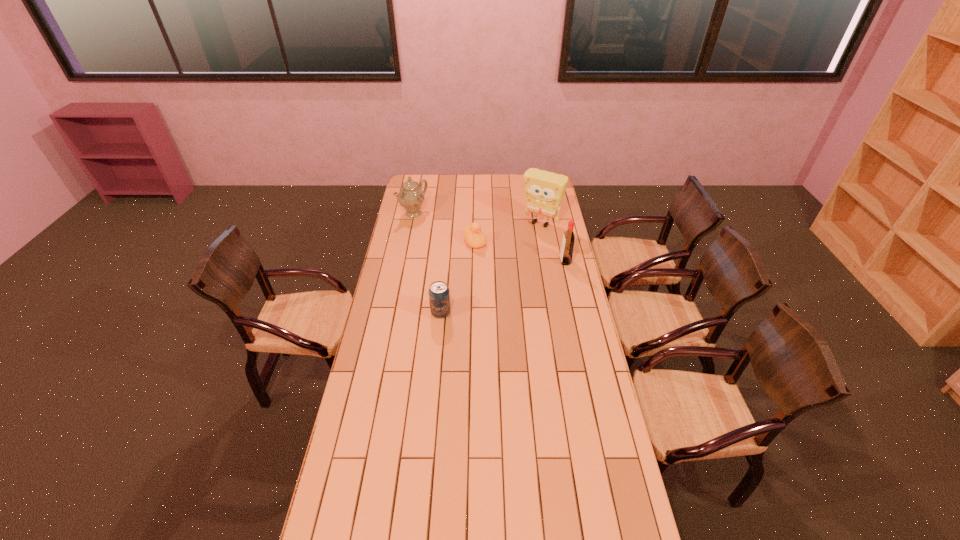
Find the location of a particular element. Image resolution: width=960 pixels, height=540 pixels. vacant spot on the desktop that is between the pop soda and the fourth farthest object and is positioned on the face of the duck is located at coordinates point(514,282).

Where is `vacant spot on the desktop that is between the fourth object from right to left and the second nearest object and is positioned on the face of the sponge`? This screenshot has width=960, height=540. vacant spot on the desktop that is between the fourth object from right to left and the second nearest object and is positioned on the face of the sponge is located at coordinates (490, 293).

Find the location of `free space on the desktop that is between the nearest object and the second nearest object and is positioned on the spout of the leftmost object`. free space on the desktop that is between the nearest object and the second nearest object and is positioned on the spout of the leftmost object is located at coordinates (521, 280).